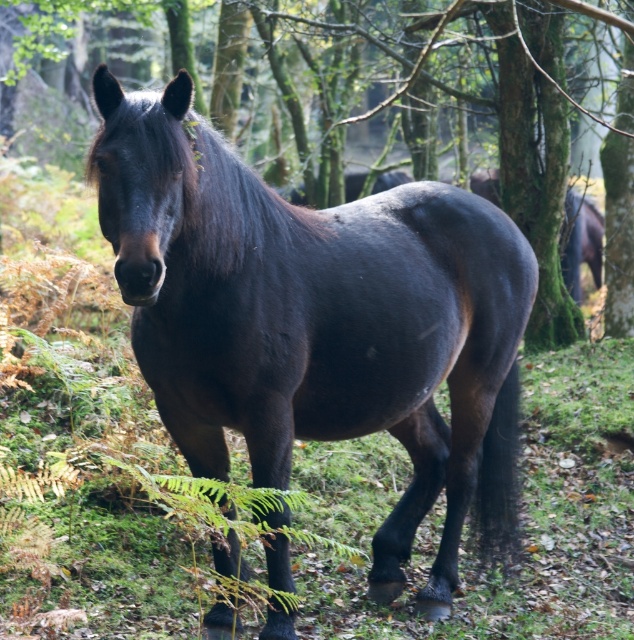
Question: Which point is farther from the camera taking this photo?

Choices:
 (A) (481, 177)
 (B) (550, 42)

Answer: (A)

Question: Estimate the real-world distances between objects in this image. Which object is closer to the shiny dark brown horse at center?

Choices:
 (A) shiny dark brown horse at right
 (B) green mossy tree at center

Answer: (B)

Question: Can you confirm if shiny dark brown horse at center is positioned to the left of shiny dark brown horse at right?

Choices:
 (A) yes
 (B) no

Answer: (A)

Question: Does green mossy tree at center have a greater width compared to shiny dark brown horse at right?

Choices:
 (A) no
 (B) yes

Answer: (B)

Question: Where is shiny dark brown horse at center located in relation to green mossy tree at center in the image?

Choices:
 (A) left
 (B) right

Answer: (A)

Question: Which of the following is the closest to the observer?

Choices:
 (A) green mossy tree at center
 (B) shiny dark brown horse at right
 (C) shiny dark brown horse at center

Answer: (C)